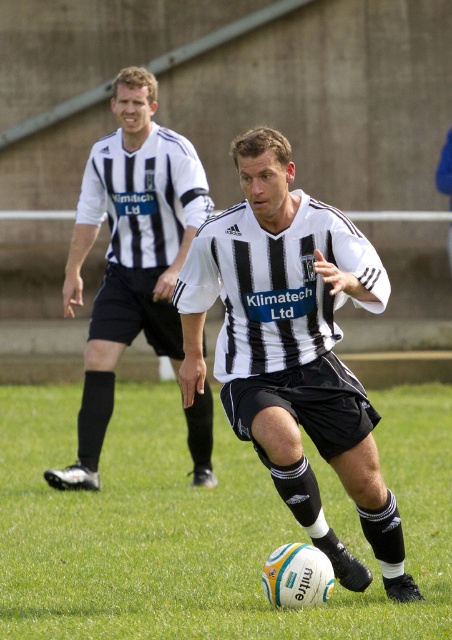
Question: Is white textured football at center positioned in front of black matte soccer ball at center?

Choices:
 (A) yes
 (B) no

Answer: (B)

Question: Among these objects, which one is farthest from the camera?

Choices:
 (A) white textured football at center
 (B) black and white striped shirt at left

Answer: (B)

Question: Which point is closer to the camera?

Choices:
 (A) black matte soccer ball at center
 (B) black and white striped shirt at left

Answer: (A)

Question: Can you confirm if white textured football at center is positioned to the left of black and white striped shirt at left?

Choices:
 (A) yes
 (B) no

Answer: (B)

Question: Which object appears closest to the camera in this image?

Choices:
 (A) black matte soccer ball at center
 (B) white textured football at center
 (C) black and white striped shirt at left

Answer: (A)

Question: Is white textured football at center wider than black matte soccer ball at center?

Choices:
 (A) yes
 (B) no

Answer: (B)